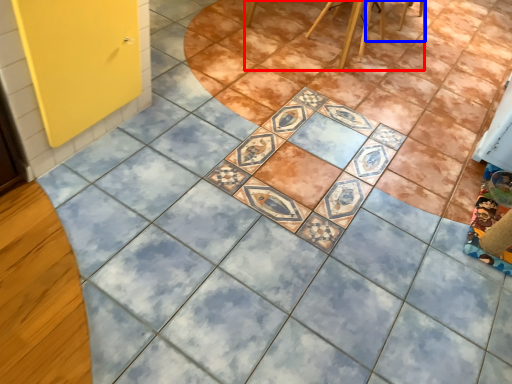
Question: Which of the following is the farthest to the observer, furniture (highlighted by a red box) or chair (highlighted by a blue box)?

Choices:
 (A) furniture
 (B) chair

Answer: (B)